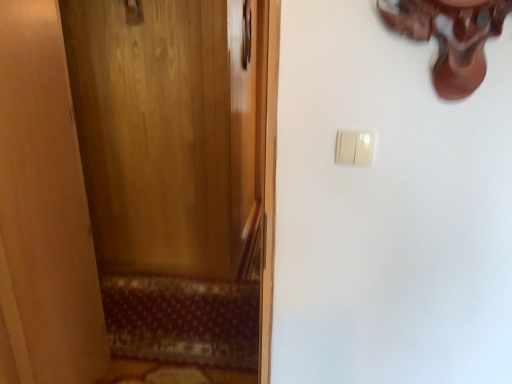
This screenshot has height=384, width=512. I want to click on free spot above patterned carpet at lower left (from a real-world perspective), so click(x=160, y=308).